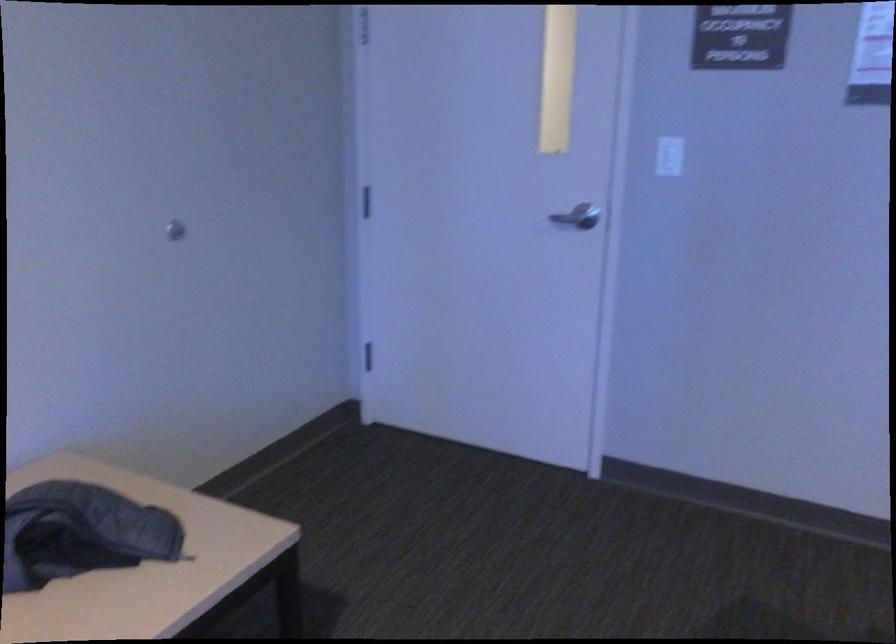
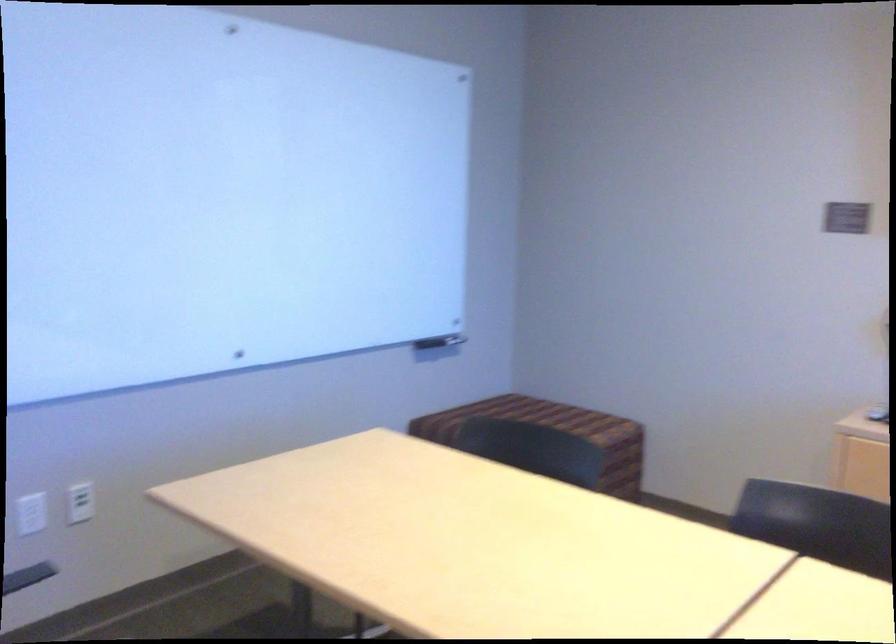
Question: How did the camera likely rotate?

Choices:
 (A) Left
 (B) Right
 (C) Up
 (D) Down

Answer: (B)